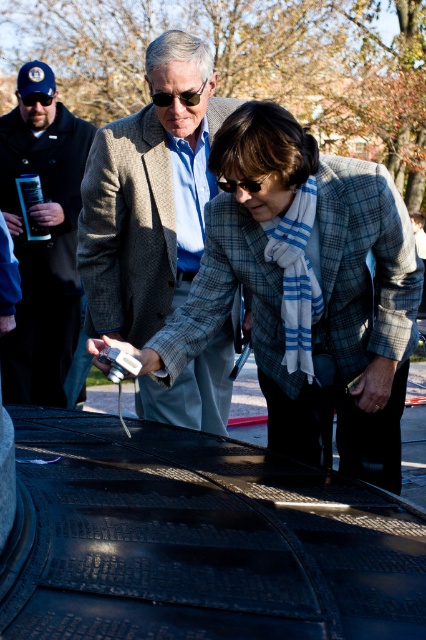
Question: Is plaid wool jacket at center further to camera compared to dark blue wool jacket at left?

Choices:
 (A) yes
 (B) no

Answer: (B)

Question: Considering the real-world distances, which object is closest to the plaid wool jacket at center?

Choices:
 (A) dark blue wool jacket at left
 (B) brown woolen coat at center

Answer: (B)

Question: Which point is closer to the camera taking this photo?

Choices:
 (A) (135, 116)
 (B) (25, 301)
 (C) (319, 337)

Answer: (C)

Question: Is plaid wool jacket at center further to camera compared to dark blue wool jacket at left?

Choices:
 (A) yes
 (B) no

Answer: (B)

Question: Among these points, which one is nearest to the camera?

Choices:
 (A) (394, 394)
 (B) (34, 172)

Answer: (A)

Question: From the image, what is the correct spatial relationship of brown woolen coat at center in relation to dark blue wool jacket at left?

Choices:
 (A) left
 (B) right

Answer: (B)